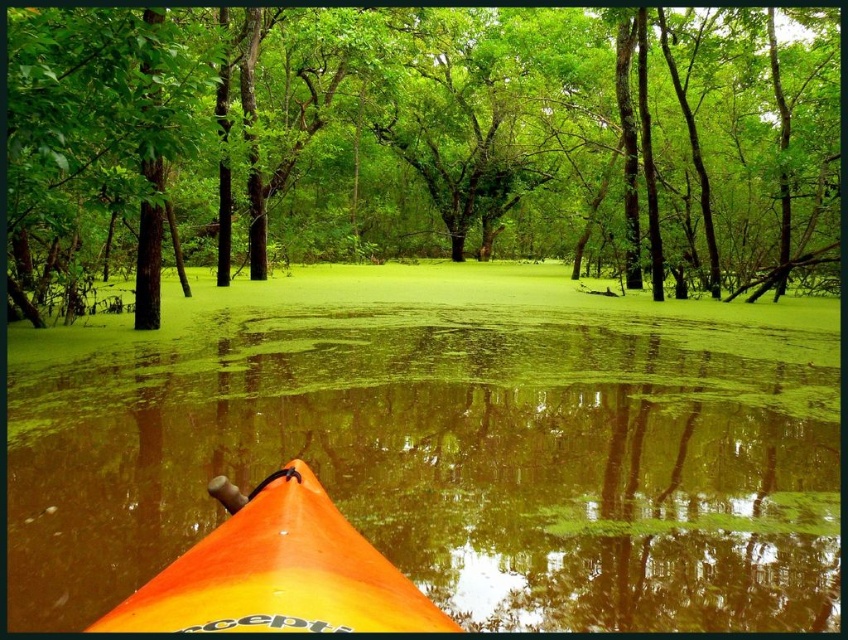
Does green leafy tree at center have a larger size compared to orange plastic kayak at lower center?

Indeed, green leafy tree at center has a larger size compared to orange plastic kayak at lower center.

Is green leafy tree at center positioned before orange plastic kayak at lower center?

No, it is not.

Is point (466, 248) positioned after point (289, 588)?

Yes, point (466, 248) is behind point (289, 588).

Identify the location of green leafy tree at center. (421, 140).

Is the position of orange kayak at lower center less distant than that of orange plastic kayak at lower center?

No, orange kayak at lower center is further to the viewer.

Identify the location of orange kayak at lower center. (447, 444).

Describe the element at coordinates (447, 444) in the screenshot. I see `orange kayak at lower center` at that location.

At what (x,y) coordinates should I click in order to perform the action: click on orange kayak at lower center. Please return your answer as a coordinate pair (x, y). Image resolution: width=848 pixels, height=640 pixels. Looking at the image, I should click on (447, 444).

Is orange kayak at lower center to the left of green leafy tree at center from the viewer's perspective?

Yes, orange kayak at lower center is to the left of green leafy tree at center.

Between point (316, 337) and point (120, 262), which one is positioned behind?

Point (120, 262)

Locate an element on the screen. This screenshot has width=848, height=640. orange kayak at lower center is located at coordinates (447, 444).

Locate an element on the screen. This screenshot has width=848, height=640. orange kayak at lower center is located at coordinates (447, 444).